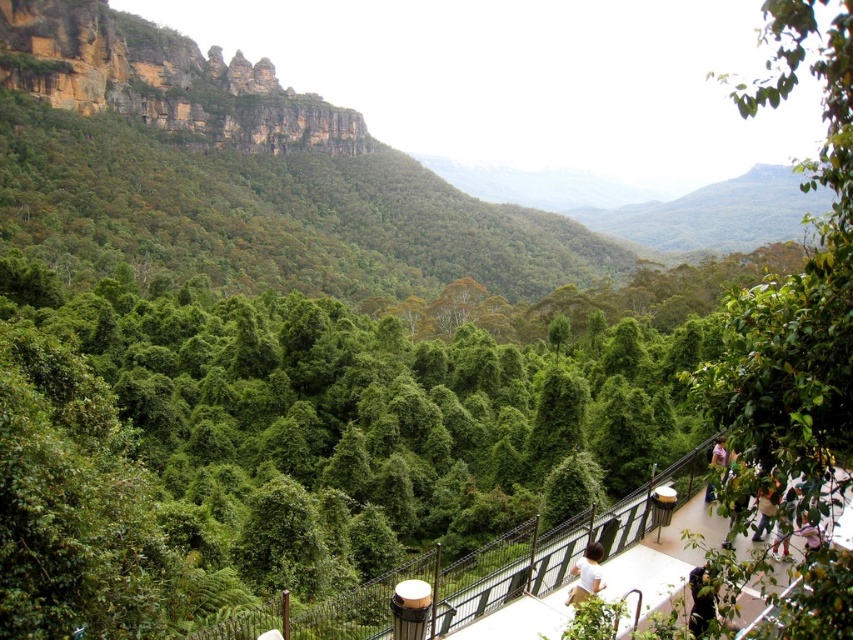
Can you confirm if green leafy forest at upper left is smaller than dark brown hair at lower right?

No, green leafy forest at upper left is not smaller than dark brown hair at lower right.

This screenshot has width=853, height=640. Identify the location of green leafy forest at upper left. (236, 176).

Between green leafy tree at right and dark brown hair at lower right, which one appears on the left side from the viewer's perspective?

From the viewer's perspective, dark brown hair at lower right appears more on the left side.

From the picture: Who is more forward, (796, 460) or (705, 611)?

Positioned in front is point (796, 460).

Identify the location of green leafy tree at right. The image size is (853, 640). (796, 282).

Between green leafy forest at upper left and white cotton shirt at lower center, which one appears on the left side from the viewer's perspective?

From the viewer's perspective, green leafy forest at upper left appears more on the left side.

Is green leafy forest at upper left to the right of white cotton shirt at lower center from the viewer's perspective?

No, green leafy forest at upper left is not to the right of white cotton shirt at lower center.

Is point (454, 276) closer to viewer compared to point (585, 572)?

No, it is not.

Image resolution: width=853 pixels, height=640 pixels. Find the location of `green leafy forest at upper left`. green leafy forest at upper left is located at coordinates (236, 176).